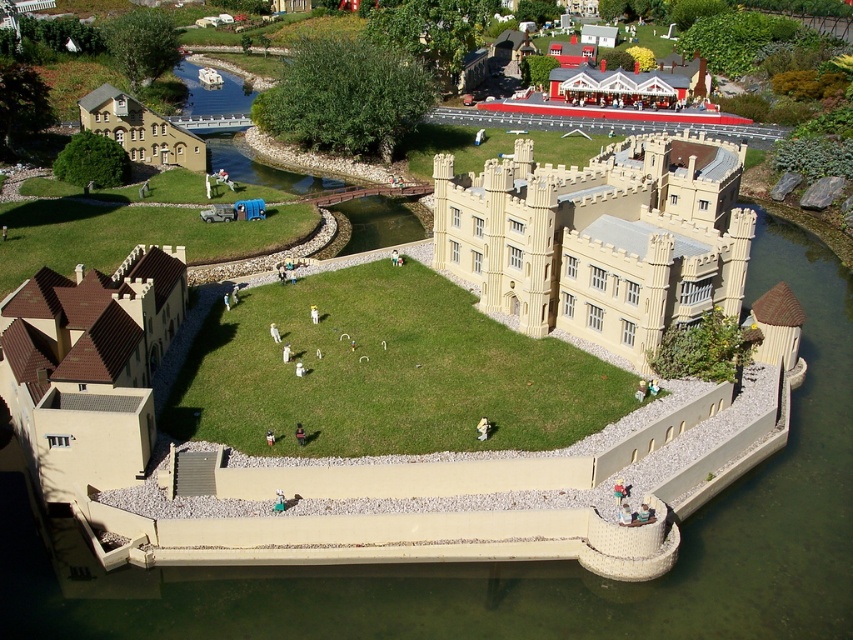
You are a drone operator tasked with capturing aerial footage of the castle. The brown tiled roof at lower left is your reference point. Based on its position, can you determine if the drone should fly clockwise or counter clockwise to maintain the castle in the frame while circling it?

The brown tiled roof at lower left is located at point (90,365), which is on the lower left side of the image. To maintain the castle in the frame while circling, the drone should fly clockwise around the castle. This ensures that the castle remains in the camera view as the drone moves along the perimeter.

You are standing in front of the miniature castle model and want to place a small flag at the point closer to you between point [619,285] and point [193,164]. Which point should you choose?

You should choose point [619,285] because it is closer to the viewer than point [193,164].